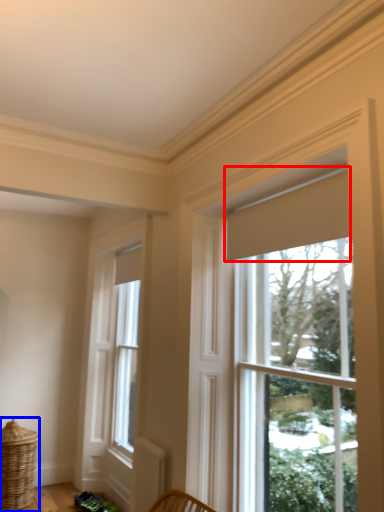
Question: Which object appears closest to the camera in this image, curtain (highlighted by a red box) or basket (highlighted by a blue box)?

Choices:
 (A) curtain
 (B) basket

Answer: (A)